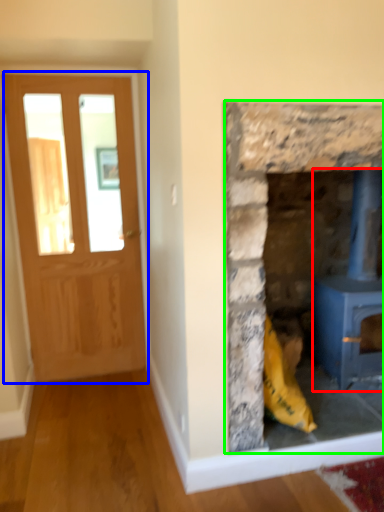
Question: Estimate the real-world distances between objects in this image. Which object is closer to wood burning stove (highlighted by a red box), glass door (highlighted by a blue box) or fireplace (highlighted by a green box)?

Choices:
 (A) glass door
 (B) fireplace

Answer: (B)